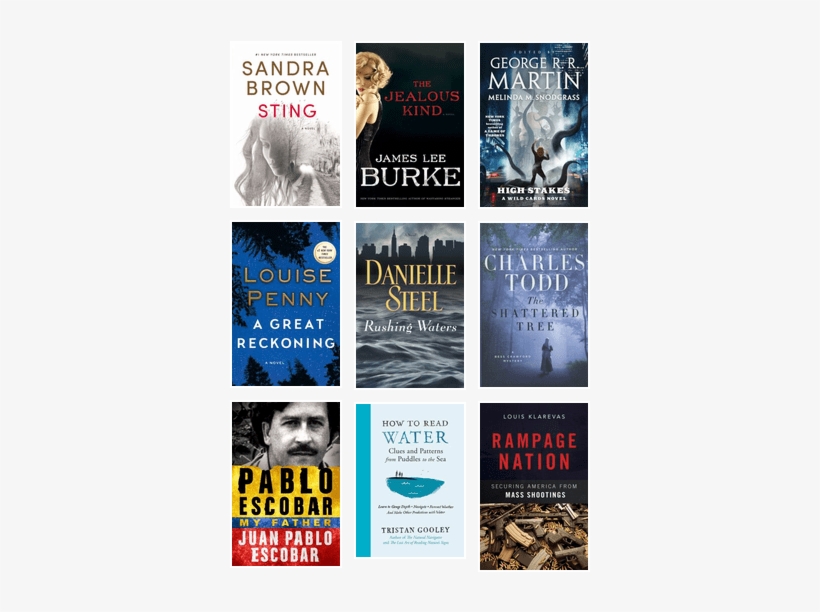
This screenshot has width=820, height=612. In order to click on book in this screenshot , I will do `click(298, 138)`, `click(412, 133)`, `click(526, 132)`, `click(287, 256)`, `click(408, 242)`, `click(530, 239)`, `click(317, 417)`, `click(418, 411)`, `click(531, 407)`.